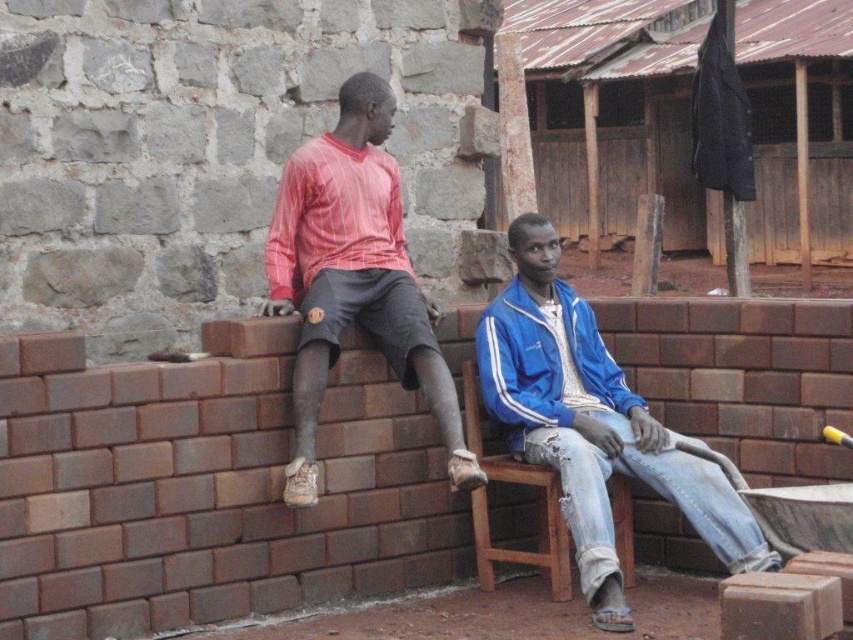
You are standing at point A which is at coordinates (614, 115). You want to go to the rusty metal hut at center. Which direction should you go?

The rusty metal hut at center is located at point (614, 115), so you are already at the location of the rusty metal hut at center.

You are planning to build a new shed in your backyard. You want to place it near the rusty metal hut at center and the wooden at right. Which existing structure should you place it closer to if you want the new shed to be larger than both?

You should place the new shed closer to the wooden at right because the rusty metal hut at center is smaller than the wooden at right. Since the new shed needs to be larger than both, positioning it near the larger structure ensures it can accommodate the required size.

You are standing at point A and want to reach the rusty metal hut at center. Which direction should you move in to get there?

You should move towards the point where the rusty metal hut at center is located at coordinates (614,115) to reach it.